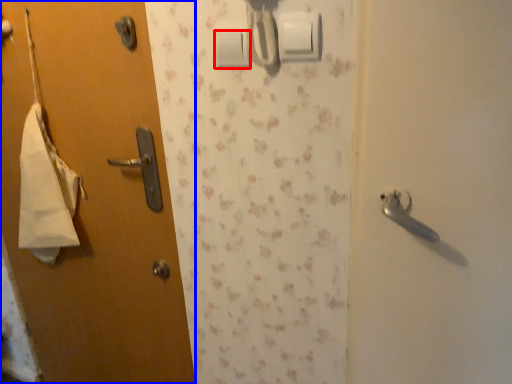
Question: Which of the following is the closest to the observer, light switch (highlighted by a red box) or door (highlighted by a blue box)?

Choices:
 (A) light switch
 (B) door

Answer: (A)